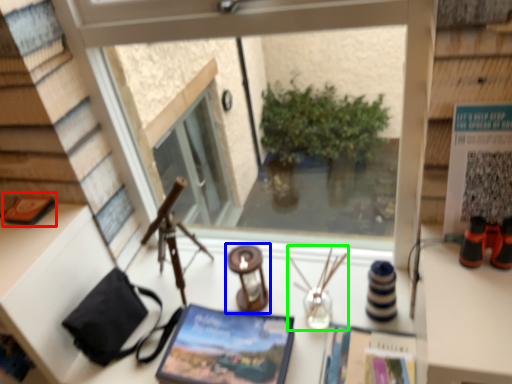
Question: Which object is the farthest from book (highlighted by a red box)? Choose among these: candle holder (highlighted by a blue box) or candle holder (highlighted by a green box).

Choices:
 (A) candle holder
 (B) candle holder

Answer: (B)